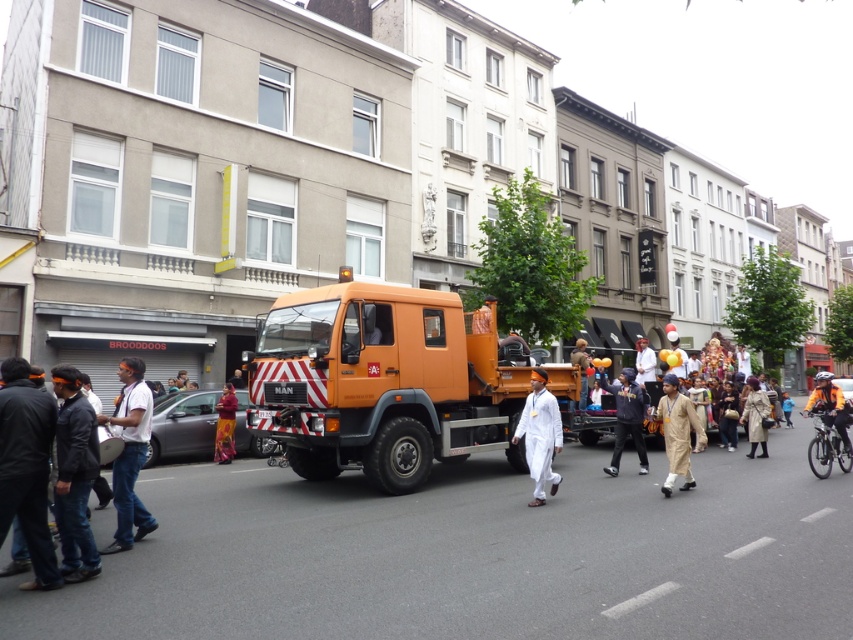
Question: Is orange matte tow truck at center thinner than blue jeans at lower left?

Choices:
 (A) no
 (B) yes

Answer: (A)

Question: Based on their relative distances, which object is nearer to the orange reflective jacket at center?

Choices:
 (A) blue jeans at lower left
 (B) light brown cotton kurta at center
 (C) dark blue fabric at center
 (D) orange matte tow truck at center

Answer: (C)

Question: Can you confirm if black leather jacket at lower left is positioned above white cotton outfit at center?

Choices:
 (A) no
 (B) yes

Answer: (B)

Question: Can you confirm if black leather jacket at lower left is positioned to the right of white cotton turban at center?

Choices:
 (A) no
 (B) yes

Answer: (A)

Question: Which point is closer to the camera taking this photo?

Choices:
 (A) pyautogui.click(x=138, y=424)
 (B) pyautogui.click(x=355, y=396)
 (C) pyautogui.click(x=759, y=408)
 (D) pyautogui.click(x=675, y=397)

Answer: (A)

Question: Which object is closer to the camera taking this photo?

Choices:
 (A) white cotton outfit at center
 (B) matte orange truck at center

Answer: (A)